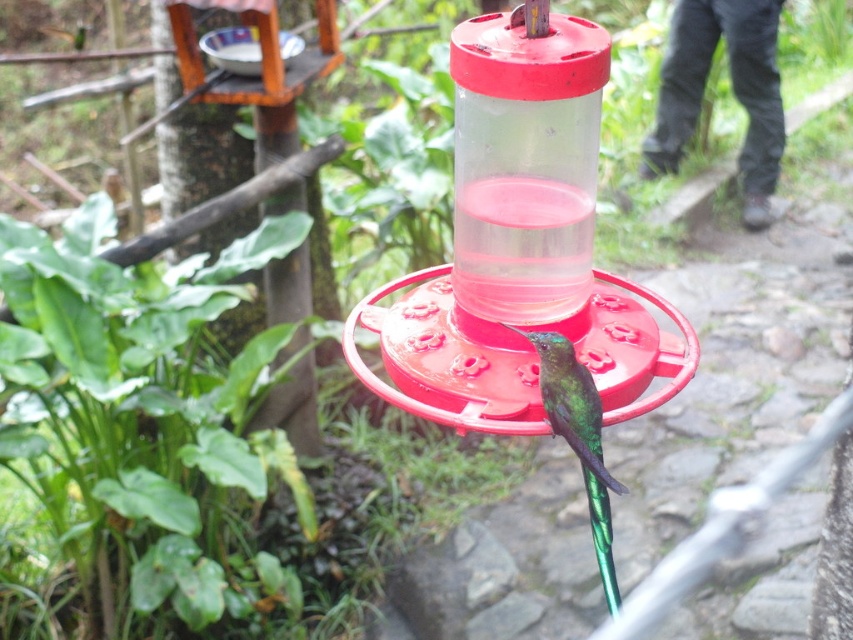
Who is positioned more to the right, transparent plastic bird feeder at center or green iridescent bird at center?

From the viewer's perspective, green iridescent bird at center appears more on the right side.

Is transparent plastic bird feeder at center positioned behind green iridescent bird at center?

No, it is not.

Locate an element on the screen. Image resolution: width=853 pixels, height=640 pixels. transparent plastic bird feeder at center is located at coordinates (520, 244).